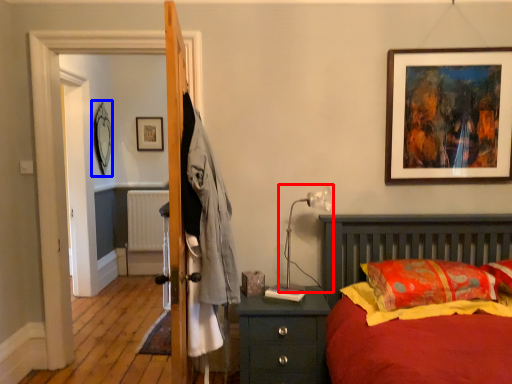
Question: Which of the following is the farthest to the observer, table lamp (highlighted by a red box) or picture frame (highlighted by a blue box)?

Choices:
 (A) table lamp
 (B) picture frame

Answer: (B)